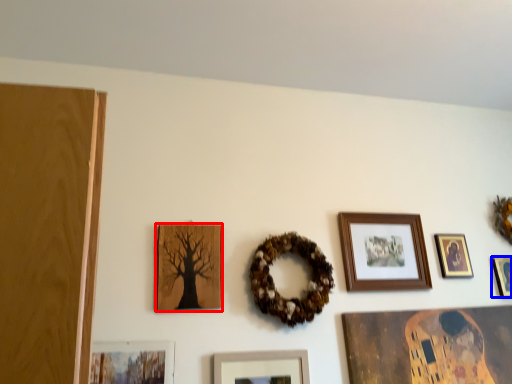
Question: Which object is closer to the camera taking this photo, picture frame (highlighted by a red box) or picture frame (highlighted by a blue box)?

Choices:
 (A) picture frame
 (B) picture frame

Answer: (A)